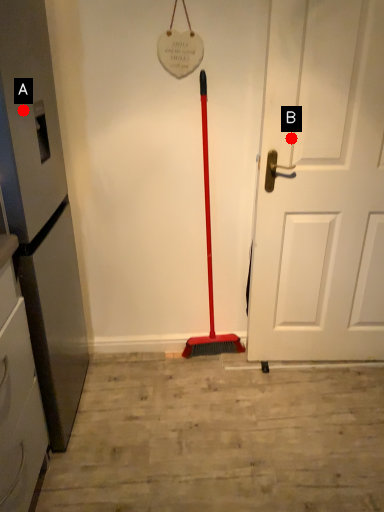
Question: Two points are circled on the image, labeled by A and B beside each circle. Which point is farther from the camera taking this photo?

Choices:
 (A) A is further
 (B) B is further

Answer: (B)